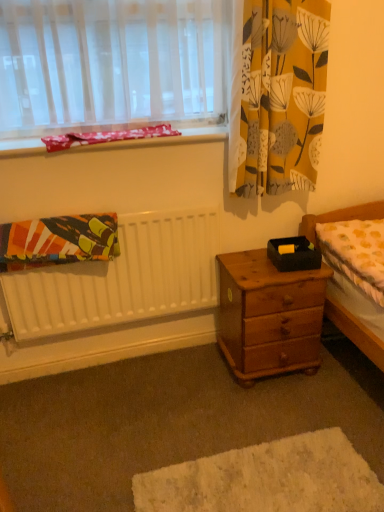
Question: Considering the relative sizes of wooden drawer at lower right and pink fabric at upper left in the image provided, is wooden drawer at lower right taller than pink fabric at upper left?

Choices:
 (A) yes
 (B) no

Answer: (A)

Question: Does wooden drawer at lower right have a lesser height compared to pink fabric at upper left?

Choices:
 (A) yes
 (B) no

Answer: (B)

Question: Is wooden drawer at lower right looking in the opposite direction of pink fabric at upper left?

Choices:
 (A) yes
 (B) no

Answer: (B)

Question: Are wooden drawer at lower right and pink fabric at upper left far apart?

Choices:
 (A) no
 (B) yes

Answer: (B)

Question: Does wooden drawer at lower right appear on the left side of pink fabric at upper left?

Choices:
 (A) no
 (B) yes

Answer: (A)

Question: Is the position of wooden drawer at lower right more distant than that of pink fabric at upper left?

Choices:
 (A) yes
 (B) no

Answer: (B)

Question: Can you confirm if pink fabric at upper left is thinner than wooden drawer at lower right?

Choices:
 (A) no
 (B) yes

Answer: (B)

Question: Does pink fabric at upper left contain wooden drawer at lower right?

Choices:
 (A) yes
 (B) no

Answer: (B)

Question: From a real-world perspective, is pink fabric at upper left physically below wooden drawer at lower right?

Choices:
 (A) yes
 (B) no

Answer: (B)

Question: Is pink fabric at upper left next to wooden drawer at lower right and touching it?

Choices:
 (A) yes
 (B) no

Answer: (B)

Question: From the image's perspective, does pink fabric at upper left appear lower than wooden drawer at lower right?

Choices:
 (A) no
 (B) yes

Answer: (A)

Question: From the image's perspective, is pink fabric at upper left located above wooden drawer at lower right?

Choices:
 (A) yes
 (B) no

Answer: (A)

Question: From a real-world perspective, is wooden nightstand at center below textured cotton blanket at left?

Choices:
 (A) yes
 (B) no

Answer: (A)